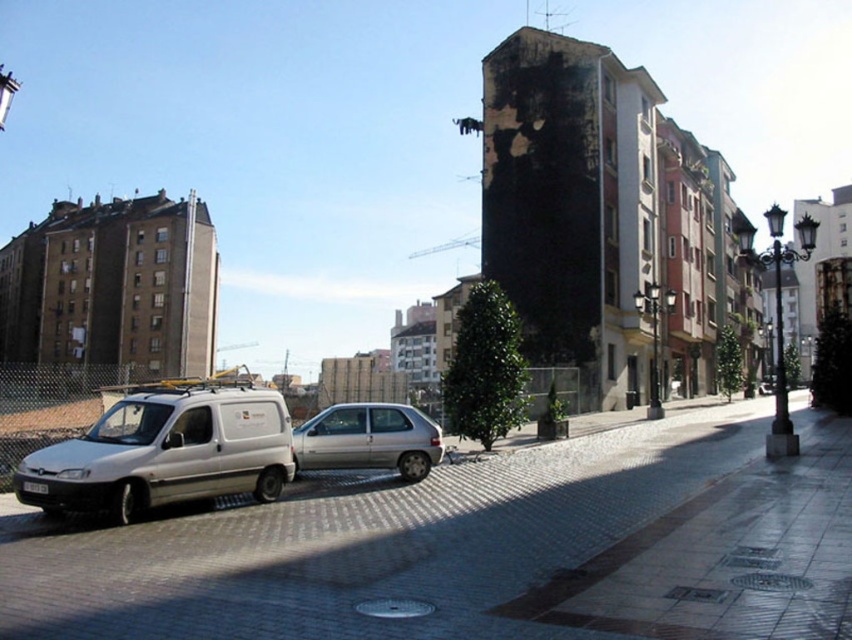
Question: Does paved stone road at center have a greater width compared to silver metallic hatchback at center?

Choices:
 (A) yes
 (B) no

Answer: (A)

Question: Observing the image, what is the correct spatial positioning of paved stone road at center in reference to white matte van at left?

Choices:
 (A) left
 (B) right

Answer: (B)

Question: Estimate the real-world distances between objects in this image. Which object is closer to the white matte van at left?

Choices:
 (A) silver metallic hatchback at center
 (B) paved stone road at center

Answer: (A)

Question: Which of the following is the closest to the observer?

Choices:
 (A) silver metallic hatchback at center
 (B) white matte van at left
 (C) paved stone road at center

Answer: (C)

Question: Is white matte van at left wider than silver metallic hatchback at center?

Choices:
 (A) no
 (B) yes

Answer: (B)

Question: Which of the following is the closest to the observer?

Choices:
 (A) (348, 419)
 (B) (234, 451)

Answer: (B)